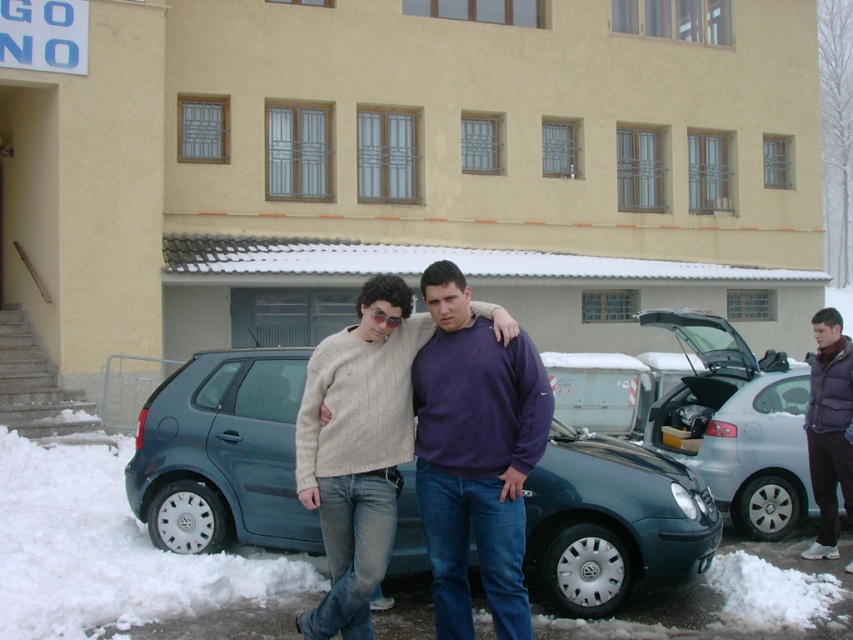
Does knitted sweater at center appear on the left side of metallic silver hatchback at center?

Correct, you'll find knitted sweater at center to the left of metallic silver hatchback at center.

Can you confirm if knitted sweater at center is positioned to the right of metallic silver hatchback at center?

Incorrect, knitted sweater at center is not on the right side of metallic silver hatchback at center.

The width and height of the screenshot is (853, 640). Identify the location of knitted sweater at center. (357, 449).

Is the position of purple cotton sweatshirt at center less distant than that of metallic silver hatchback at center?

Yes, it is in front of metallic silver hatchback at center.

The height and width of the screenshot is (640, 853). What do you see at coordinates (474, 456) in the screenshot?
I see `purple cotton sweatshirt at center` at bounding box center [474, 456].

Find the location of `purple cotton sweatshirt at center`. purple cotton sweatshirt at center is located at coordinates (474, 456).

Is metallic silver hatchback at center wider than purple fleece jacket at lower right?

Indeed, metallic silver hatchback at center has a greater width compared to purple fleece jacket at lower right.

Can you confirm if metallic silver hatchback at center is bigger than purple fleece jacket at lower right?

Correct, metallic silver hatchback at center is larger in size than purple fleece jacket at lower right.

Image resolution: width=853 pixels, height=640 pixels. In order to click on metallic silver hatchback at center in this screenshot , I will do `click(735, 422)`.

This screenshot has width=853, height=640. What are the coordinates of `metallic silver hatchback at center` in the screenshot? It's located at (735, 422).